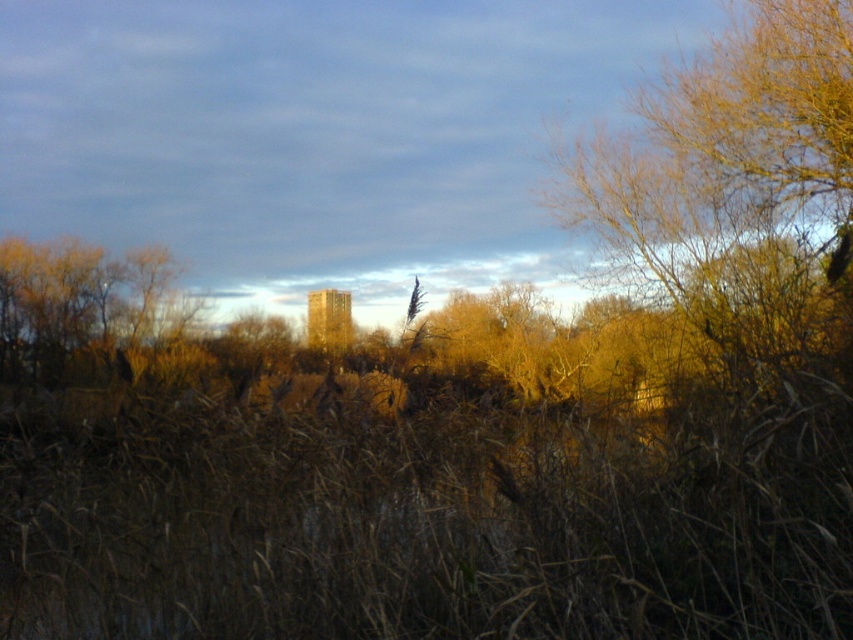
Question: Which object is positioned closest to the brown leafy tree at upper right?

Choices:
 (A) brown dry grass at left
 (B) brown dry grass at center

Answer: (B)

Question: Among these objects, which one is nearest to the camera?

Choices:
 (A) brown leafy tree at upper right
 (B) brown dry grass at left
 (C) brown dry grass at center

Answer: (C)

Question: Does brown leafy tree at upper right have a smaller size compared to brown dry grass at left?

Choices:
 (A) no
 (B) yes

Answer: (A)

Question: Can you confirm if brown leafy tree at upper right is thinner than brown dry grass at left?

Choices:
 (A) no
 (B) yes

Answer: (B)

Question: Observing the image, what is the correct spatial positioning of brown dry grass at center in reference to brown dry grass at left?

Choices:
 (A) above
 (B) below

Answer: (B)

Question: Which point is farther to the camera?

Choices:
 (A) (91, 582)
 (B) (784, 116)

Answer: (B)